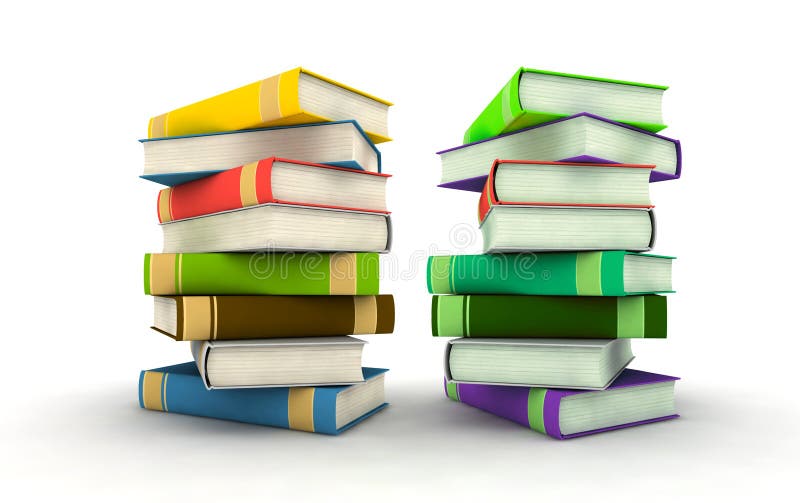
Locate an element on the screen. books in left stack is located at coordinates (298, 415), (292, 372), (282, 307), (277, 280), (282, 225), (290, 194), (305, 140), (318, 101).